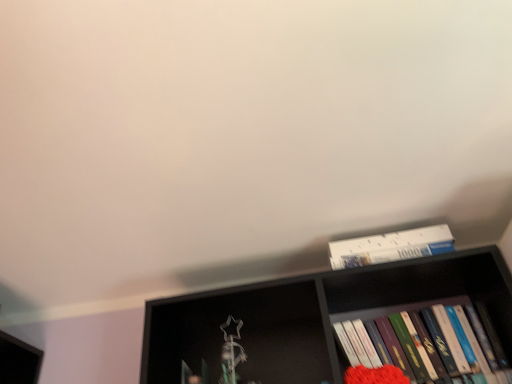
Question: From a real-world perspective, is black matte bookshelf at upper center positioned above or below hardcover books at right, the first book positioned from the bottom?

Choices:
 (A) above
 (B) below

Answer: (A)

Question: From the image's perspective, is black matte bookshelf at upper center located above or below hardcover books at right, the second book from the top?

Choices:
 (A) below
 (B) above

Answer: (B)

Question: Considering the real-world distances, which object is closest to the black matte bookshelf at upper center?

Choices:
 (A) hardcover books at right, the second book from the top
 (B) white paperboard puzzle at upper right, the 2th book from the bottom

Answer: (A)

Question: Based on their relative distances, which object is farther from the hardcover books at right, the second book from the top?

Choices:
 (A) white paperboard puzzle at upper right, the 2th book from the bottom
 (B) black matte bookshelf at upper center

Answer: (A)